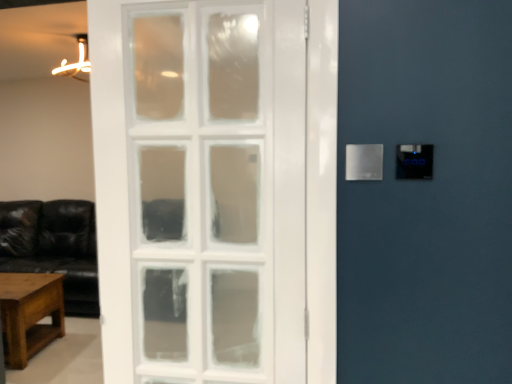
Describe the element at coordinates (364, 162) in the screenshot. I see `satin silver panel at right` at that location.

The height and width of the screenshot is (384, 512). Identify the location of satin silver panel at right. click(x=364, y=162).

What do you see at coordinates (30, 314) in the screenshot? The height and width of the screenshot is (384, 512). I see `wooden coffee table at lower left` at bounding box center [30, 314].

Find the location of `wooden coffee table at lower left`. wooden coffee table at lower left is located at coordinates (30, 314).

Where is `satin silver panel at right`? satin silver panel at right is located at coordinates (364, 162).

Based on their positions, is wooden coffee table at lower left located to the left or right of satin silver panel at right?

Clearly, wooden coffee table at lower left is on the left of satin silver panel at right in the image.

Which object is closer to the camera, wooden coffee table at lower left or satin silver panel at right?

satin silver panel at right is in front.

Is point (4, 278) behind point (366, 157)?

Yes, point (4, 278) is farther from viewer.

In the scene shown: From the image's perspective, who appears lower, wooden coffee table at lower left or satin silver panel at right?

wooden coffee table at lower left is shown below in the image.

Looking at this image, from a real-world perspective, which is physically above, wooden coffee table at lower left or satin silver panel at right?

From a 3D spatial view, satin silver panel at right is above.

In terms of width, does wooden coffee table at lower left look wider or thinner when compared to satin silver panel at right?

Clearly, wooden coffee table at lower left has more width compared to satin silver panel at right.

Does wooden coffee table at lower left have a greater height compared to satin silver panel at right?

Yes, wooden coffee table at lower left is taller than satin silver panel at right.

Between wooden coffee table at lower left and satin silver panel at right, which one has larger size?

wooden coffee table at lower left.

From the picture: Is wooden coffee table at lower left not within satin silver panel at right?

Yes.

Is wooden coffee table at lower left in contact with satin silver panel at right?

No.

Is wooden coffee table at lower left looking in the opposite direction of satin silver panel at right?

No, wooden coffee table at lower left is not facing away from satin silver panel at right.

In the scene shown: How different are the orientations of wooden coffee table at lower left and satin silver panel at right in degrees?

The angular difference between wooden coffee table at lower left and satin silver panel at right is 0.342 degrees.

How far apart are wooden coffee table at lower left and satin silver panel at right?

wooden coffee table at lower left is 2.92 meters from satin silver panel at right.

The image size is (512, 384). I want to click on table that is below the satin silver panel at right (from the image's perspective), so click(30, 314).

Considering the positions of objects satin silver panel at right and wooden coffee table at lower left in the image provided, who is more to the left, satin silver panel at right or wooden coffee table at lower left?

wooden coffee table at lower left.

Which object is closer to the camera, satin silver panel at right or wooden coffee table at lower left?

satin silver panel at right is more forward.

Does point (381, 169) come farther from viewer compared to point (7, 274)?

No, it is in front of (7, 274).

From the image's perspective, does satin silver panel at right appear lower than wooden coffee table at lower left?

No.

From a real-world perspective, is satin silver panel at right on top of wooden coffee table at lower left?

Yes, from a real-world perspective, satin silver panel at right is on top of wooden coffee table at lower left.

Considering the sizes of objects satin silver panel at right and wooden coffee table at lower left in the image provided, who is thinner, satin silver panel at right or wooden coffee table at lower left?

satin silver panel at right is thinner.

Between satin silver panel at right and wooden coffee table at lower left, which one has more height?

With more height is wooden coffee table at lower left.

Which of these two, satin silver panel at right or wooden coffee table at lower left, is bigger?

wooden coffee table at lower left is bigger.

Would you say satin silver panel at right is outside wooden coffee table at lower left?

satin silver panel at right lies outside wooden coffee table at lower left's area.

Is satin silver panel at right beside wooden coffee table at lower left?

They are not placed beside each other.

Looking at this image, does satin silver panel at right turn towards wooden coffee table at lower left?

No, satin silver panel at right is not oriented towards wooden coffee table at lower left.

What's the angular difference between satin silver panel at right and wooden coffee table at lower left's facing directions?

The angular difference between satin silver panel at right and wooden coffee table at lower left is 0.342 degrees.

Image resolution: width=512 pixels, height=384 pixels. Find the location of `light switch on the right of wooden coffee table at lower left`. light switch on the right of wooden coffee table at lower left is located at coordinates (364, 162).

Where is `table below the satin silver panel at right (from a real-world perspective)`? This screenshot has height=384, width=512. table below the satin silver panel at right (from a real-world perspective) is located at coordinates (30, 314).

Find the location of a particular element. Image resolution: width=512 pixels, height=384 pixels. table below the satin silver panel at right (from the image's perspective) is located at coordinates click(x=30, y=314).